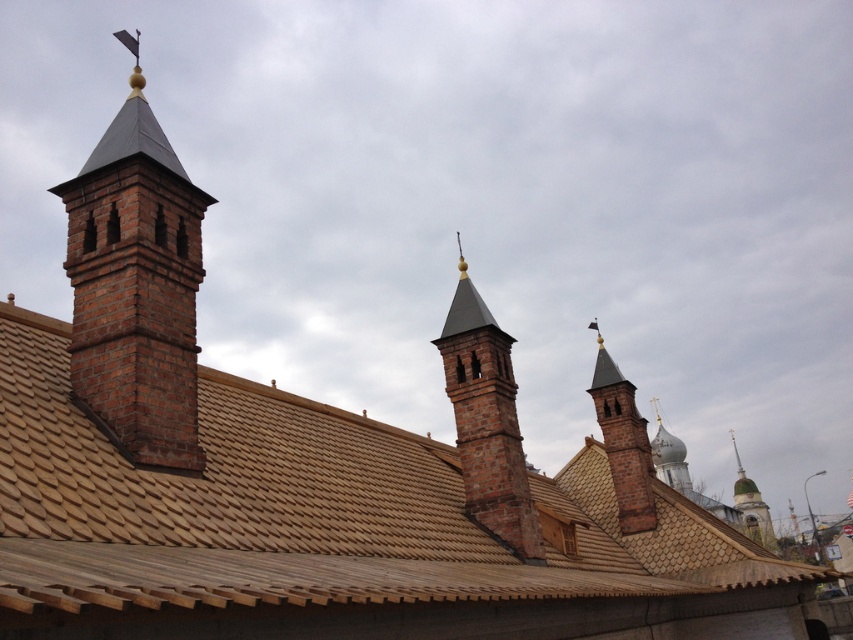
Who is positioned more to the right, brick chimney at upper right or greenish stone tower at right?

greenish stone tower at right

Is brick chimney at upper right closer to camera compared to greenish stone tower at right?

Yes.

Who is more distant from viewer, (625, 492) or (753, 529)?

The point (753, 529) is behind.

Locate an element on the screen. brick chimney at upper right is located at coordinates (624, 442).

Looking at this image, does brick chimney at left have a lesser width compared to brick chimney at upper right?

Yes.

The height and width of the screenshot is (640, 853). Identify the location of brick chimney at left. (136, 288).

Does brown brick chimney at center appear over brick chimney at upper right?

Correct, brown brick chimney at center is located above brick chimney at upper right.

Find the location of `brown brick chimney at center`. brown brick chimney at center is located at coordinates (486, 422).